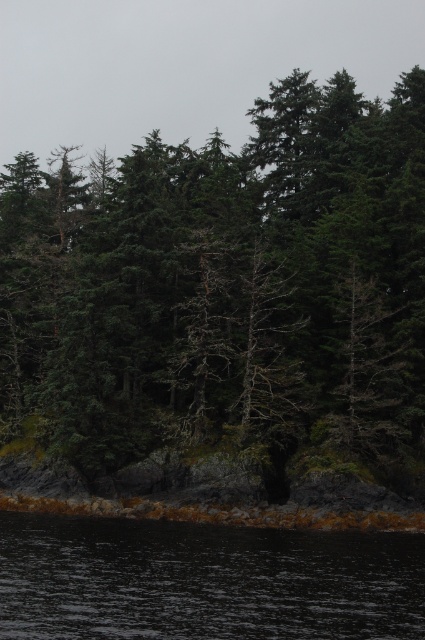
Question: Which point is farther to the camera?

Choices:
 (A) green matte tree at center
 (B) dark water at lower center

Answer: (A)

Question: Is green matte tree at center above dark water at lower center?

Choices:
 (A) yes
 (B) no

Answer: (A)

Question: Where is green matte tree at center located in relation to dark water at lower center in the image?

Choices:
 (A) right
 (B) left

Answer: (B)

Question: Which object appears farthest from the camera in this image?

Choices:
 (A) green matte tree at center
 (B) dark water at lower center

Answer: (A)

Question: Can you confirm if green matte tree at center is positioned below dark water at lower center?

Choices:
 (A) yes
 (B) no

Answer: (B)

Question: Which point is closer to the camera?

Choices:
 (A) (422, 400)
 (B) (110, 589)

Answer: (B)